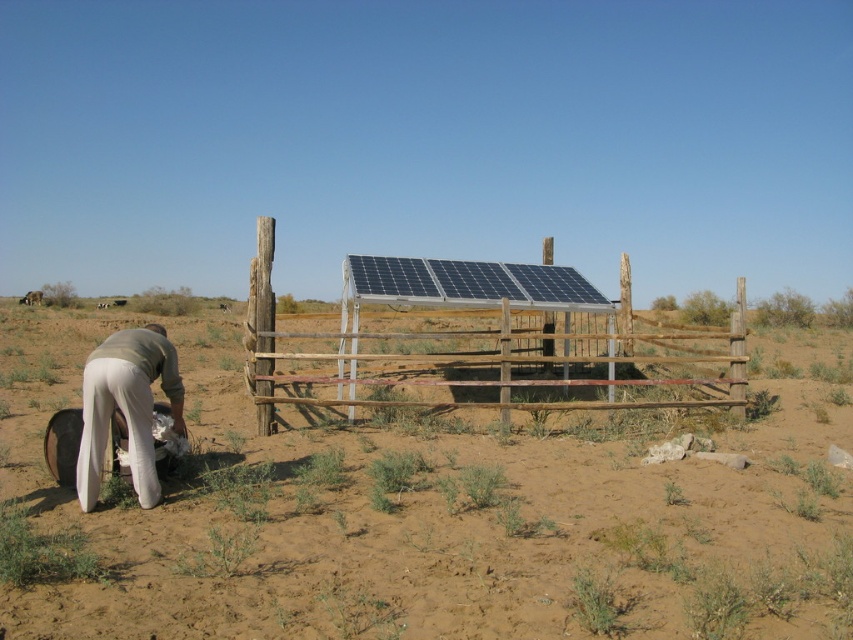
Question: Does brown sandy dirt field at center appear over light beige fabric at lower left?

Choices:
 (A) no
 (B) yes

Answer: (A)

Question: Which object is the farthest from the light beige fabric at lower left?

Choices:
 (A) wooden fence at center
 (B) brown sandy dirt field at center

Answer: (A)

Question: Among these objects, which one is nearest to the camera?

Choices:
 (A) brown sandy dirt field at center
 (B) light beige fabric at lower left
 (C) wooden fence at center

Answer: (A)

Question: Among these objects, which one is nearest to the camera?

Choices:
 (A) light beige fabric at lower left
 (B) brown sandy dirt field at center
 (C) wooden fence at center

Answer: (B)

Question: Can you confirm if wooden fence at center is positioned below light beige fabric at lower left?

Choices:
 (A) no
 (B) yes

Answer: (A)

Question: Observing the image, what is the correct spatial positioning of brown sandy dirt field at center in reference to wooden fence at center?

Choices:
 (A) above
 (B) below

Answer: (B)